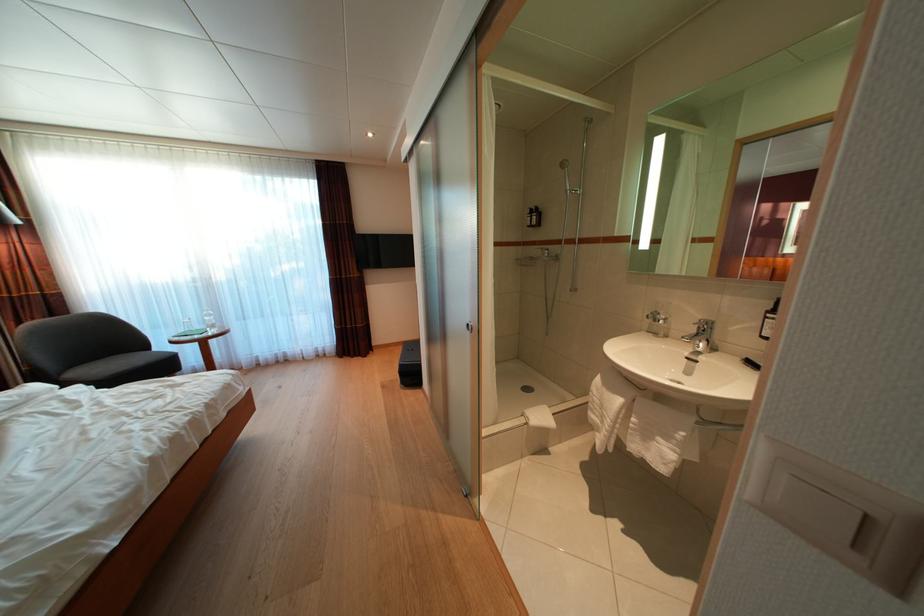
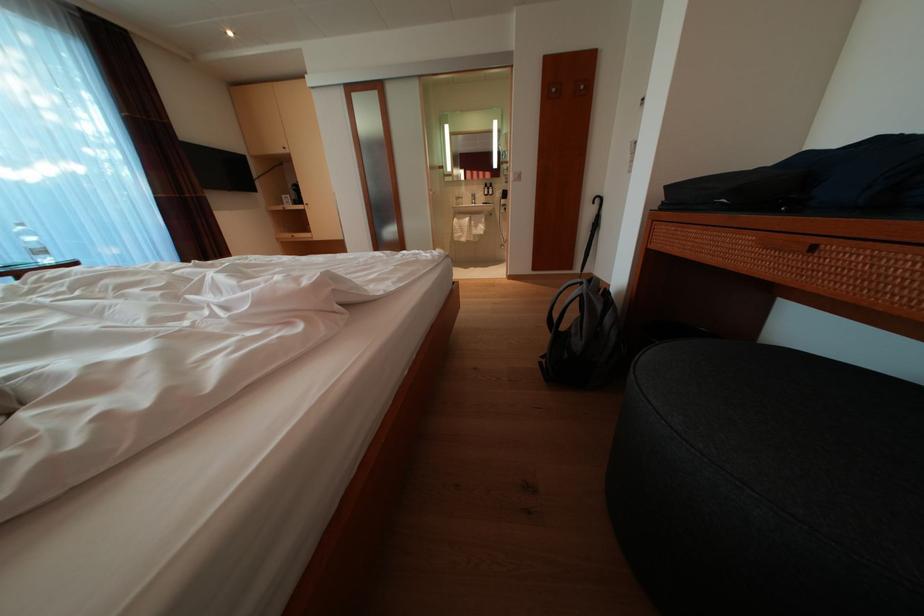
In the second image, find the point that corresponds to (627,407) in the first image.

(476, 225)